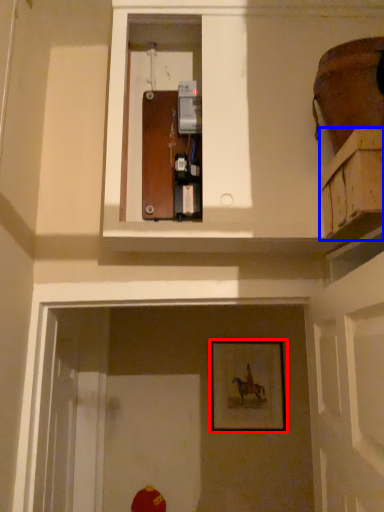
Question: Which of the following is the farthest to the observer, picture frame (highlighted by a red box) or cabinetry (highlighted by a blue box)?

Choices:
 (A) picture frame
 (B) cabinetry

Answer: (A)